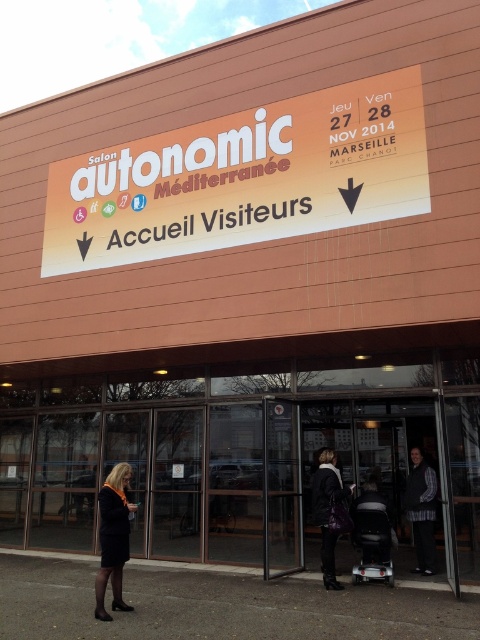
Is point (412, 118) less distant than point (359, 577)?

No.

Who is more forward, (344, 84) or (352, 579)?

Point (352, 579) is in front.

Which is in front, point (369, 134) or point (362, 579)?

Point (362, 579) is in front.

Where is `orange matte sign at upper center`? orange matte sign at upper center is located at coordinates (243, 177).

Is black wool coat at lower left wider than dark brown leather jacket at center?

In fact, black wool coat at lower left might be narrower than dark brown leather jacket at center.

Is black wool coat at lower left to the right of dark brown leather jacket at center from the viewer's perspective?

In fact, black wool coat at lower left is to the left of dark brown leather jacket at center.

Is point (116, 536) positioned before point (327, 566)?

Yes.

Locate an element on the screen. The height and width of the screenshot is (640, 480). black wool coat at lower left is located at coordinates tap(113, 538).

Which is more to the left, orange matte sign at upper center or black wool coat at lower left?

From the viewer's perspective, black wool coat at lower left appears more on the left side.

Does orange matte sign at upper center have a smaller size compared to black wool coat at lower left?

No, orange matte sign at upper center is not smaller than black wool coat at lower left.

This screenshot has width=480, height=640. I want to click on orange matte sign at upper center, so click(243, 177).

I want to click on orange matte sign at upper center, so click(x=243, y=177).